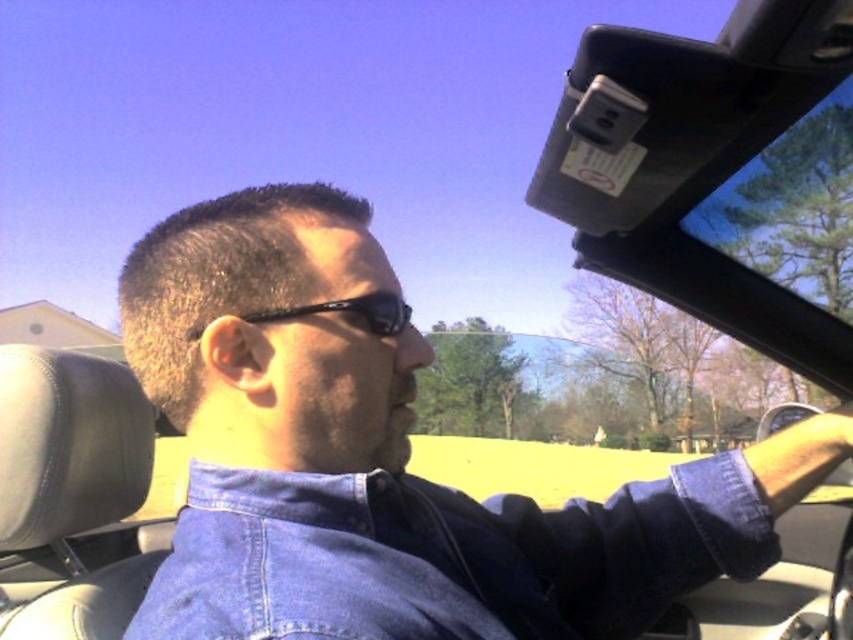
You are a fashion designer observing the image and want to create a matching accessory set for the faded denim jacket at lower right and the black reflective sunglasses at center. Based on their proximity in the image, can you estimate if they are close enough to be considered part of the same outfit?

The faded denim jacket at lower right is 14.08 inches from the black reflective sunglasses at center, so they are close enough to be considered part of the same outfit.